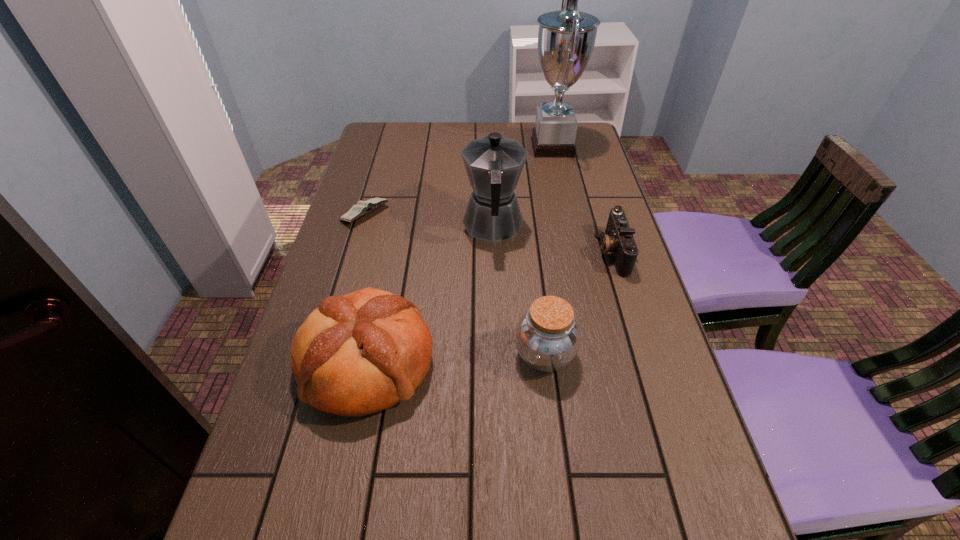
Image resolution: width=960 pixels, height=540 pixels. I want to click on vacant area that lies between the bread and the jar, so click(x=456, y=359).

Identify the location of vacant point located between the diary and the farthest object. click(x=459, y=180).

The image size is (960, 540). Find the location of `free space between the diary and the jar`. free space between the diary and the jar is located at coordinates (455, 284).

At what (x,y) coordinates should I click in order to perform the action: click on vacant area between the jar and the bread. Please return your answer as a coordinate pair (x, y). The image size is (960, 540). Looking at the image, I should click on (456, 359).

Locate an element on the screen. Image resolution: width=960 pixels, height=540 pixels. the fourth closest object to the bread is located at coordinates (618, 239).

In order to click on object that is the fifth closest to the second shortest object in this screenshot , I will do `click(363, 207)`.

Identify the location of vacant region that satisfies the following two spatial constraints: 1. at the front view of the tallest object; 2. on the front side of the bread. (601, 362).

This screenshot has width=960, height=540. Identify the location of free spot that satisfies the following two spatial constraints: 1. at the front view of the farthest object; 2. on the front side of the bread. (601, 362).